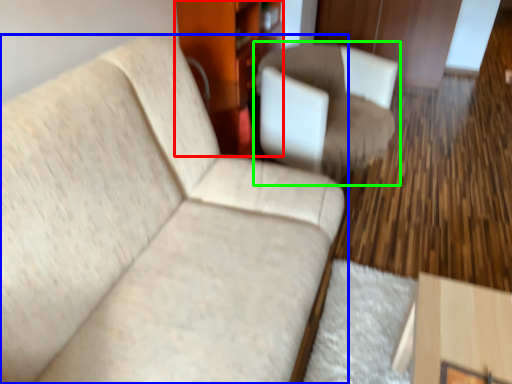
Question: Considering the real-world distances, which object is farthest from dresser (highlighted by a red box)? studio couch (highlighted by a blue box) or chair (highlighted by a green box)?

Choices:
 (A) studio couch
 (B) chair

Answer: (A)